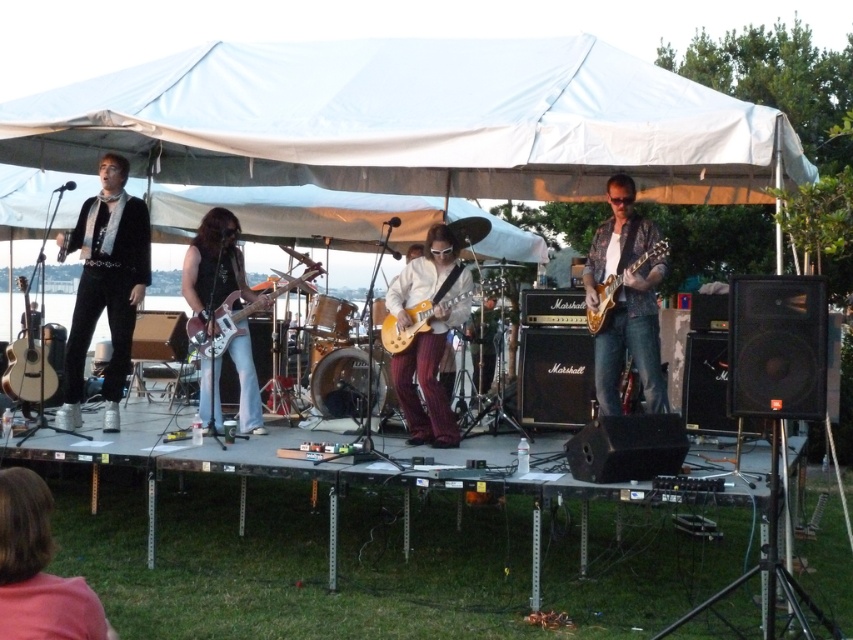
You are a stagehand and need to place a new microphone stand between the matte white acoustic guitar at left and the glossy electric guitar at center. Since the acoustic guitar is larger, will you have enough space between them to fit the stand?

The matte white acoustic guitar at left is larger than the glossy electric guitar at center. Therefore, there should be sufficient space between them to accommodate the microphone stand.

You are a photographer at the live music performance. You need to capture a clear shot of the wooden electric guitar at center without any obstructions. Is the pink fabric at lower left blocking the view of the guitar?

The pink fabric at lower left is positioned under the wooden electric guitar at center, so it is not blocking the view of the guitar.

You are a photographer at the live music performance. You want to capture a photo that includes both the pink fabric at lower left and the wooden electric guitar at center. Based on their positions, which object should you place on the left side of your photo to ensure both are visible?

The pink fabric at lower left is positioned on the right side of wooden electric guitar at center, so to ensure both are visible, you should place the wooden electric guitar at center on the left side of your photo and the pink fabric at lower left on the right side.